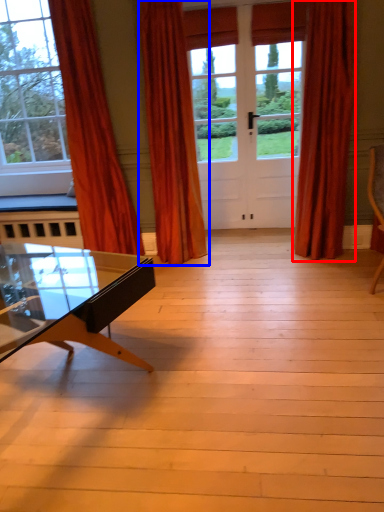
Question: Which object is further to the camera taking this photo, curtain (highlighted by a red box) or curtain (highlighted by a blue box)?

Choices:
 (A) curtain
 (B) curtain

Answer: (A)